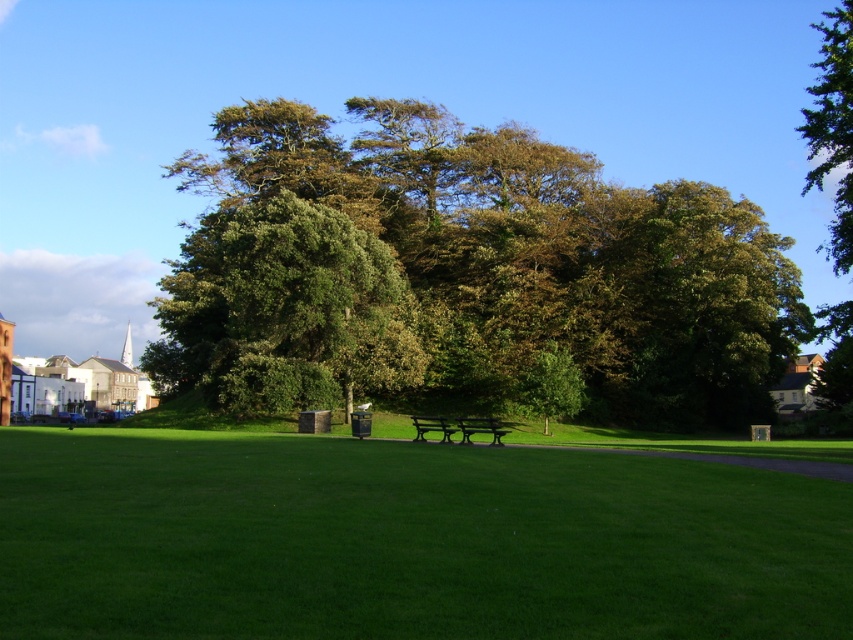
Based on the photo, you are standing at the point marked by coordinates point (405, 540) in the park. What type of terrain are you currently standing on?

You are standing on green grass at center, as indicated by the coordinates point 0.846, 0.476.

You are standing in the park and want to take a photo of the green leafy tree at upper right. The camera you have can focus on objects up to 30 meters away. Will the tree be in focus?

The green leafy tree at upper right is 28.89 meters from viewer, so yes, the tree will be in focus since it is within the camera focus range of 30 meters.

You are standing in the park and want to take a photo of both the point at coordinates point (825,307) and point (467,440). Which point should you focus on first to ensure both are in focus?

You should focus on point (467,440) first because it is closer to the camera than point (825,307). By focusing on the closer point, the further point will also be in focus due to the depth of field.